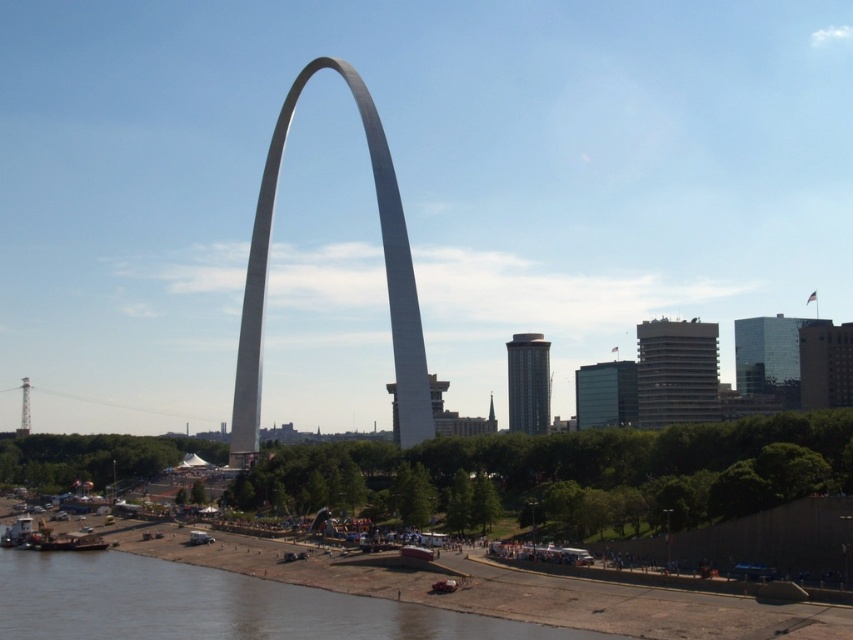
You are standing at the base of the Gateway Arch and want to cross the brown sedimentary river at lower center to reach the city buildings in the background. Given that the average person can walk 3 feet per second, how many seconds will it take to reach the river?

The brown sedimentary river at lower center is 302.55 feet from viewer. At a walking speed of 3 feet per second, it would take approximately 100.85 seconds to reach the river.

You are a tourist standing in front of the white polished concrete arch at center and want to take a photo of the brown sedimentary river at lower center. Which direction should you turn to face the river?

The brown sedimentary river at lower center is to the left of the white polished concrete arch at center, so you should turn to your left to face the river.

Consider the image. You are a photographer planning to capture the Gateway Arch and the river in a single shot. Based on the scene, which object, the brown sedimentary river at lower center or the white polished concrete arch at center, will appear taller in your photo?

The white polished concrete arch at center will appear taller in the photo because the brown sedimentary river at lower center is not as tall as it.